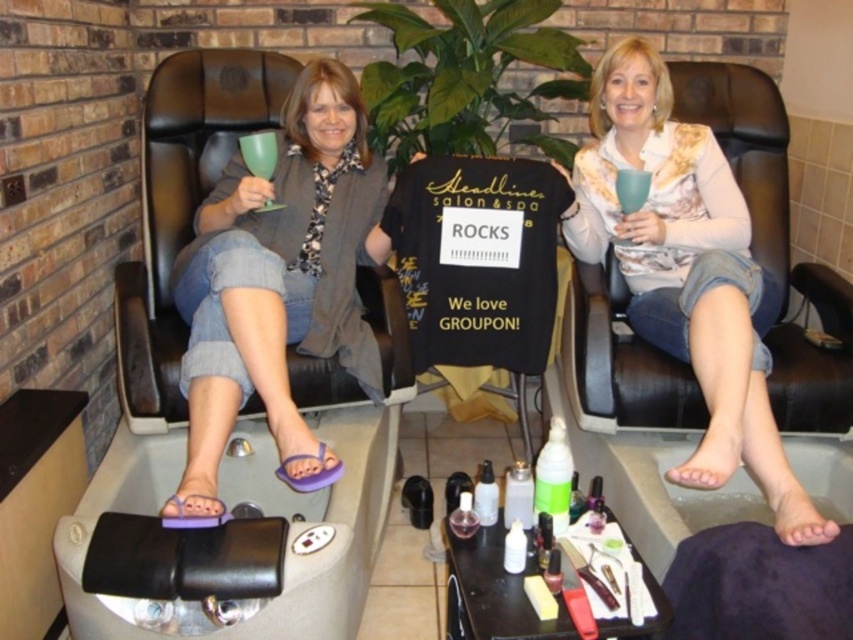
Question: Is purple flip-flops at lower left to the left of matte white shirt at center from the viewer's perspective?

Choices:
 (A) no
 (B) yes

Answer: (B)

Question: Does purple flip-flops at lower left lie behind matte white shirt at center?

Choices:
 (A) no
 (B) yes

Answer: (A)

Question: Which of the following is the closest to the observer?

Choices:
 (A) matte white shirt at center
 (B) purple flip-flops at lower left

Answer: (B)

Question: Which of the following is the farthest from the observer?

Choices:
 (A) (347, 84)
 (B) (660, 124)

Answer: (B)

Question: Does purple flip-flops at lower left lie in front of matte white shirt at center?

Choices:
 (A) yes
 (B) no

Answer: (A)

Question: Which of the following is the farthest from the observer?

Choices:
 (A) (305, 456)
 (B) (708, 304)

Answer: (B)